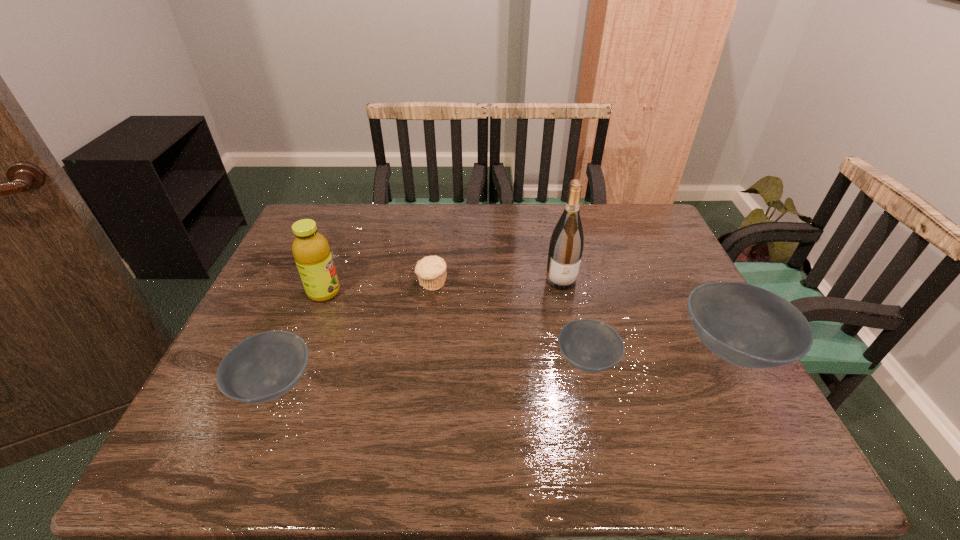
What are the coordinates of `the second shortest bowl` in the screenshot? It's located at (263, 367).

Image resolution: width=960 pixels, height=540 pixels. In order to click on the second bowl from left to right in this screenshot , I will do `click(589, 345)`.

Find the location of `the shortest object`. the shortest object is located at coordinates (589, 345).

Find the location of a particular element. The width and height of the screenshot is (960, 540). the tallest bowl is located at coordinates (748, 326).

Where is `the rightmost bowl`? the rightmost bowl is located at coordinates (748, 326).

The width and height of the screenshot is (960, 540). What are the coordinates of `fruit juice` in the screenshot? It's located at (311, 251).

The width and height of the screenshot is (960, 540). Find the location of `the fourth object from right to left`. the fourth object from right to left is located at coordinates (431, 270).

The image size is (960, 540). Identify the location of wine bottle. (566, 245).

Image resolution: width=960 pixels, height=540 pixels. In order to click on free region located on the back of the second shortest bowl in this screenshot , I will do `click(327, 258)`.

In order to click on free space located on the left of the second bowl from left to right in this screenshot , I will do `click(393, 360)`.